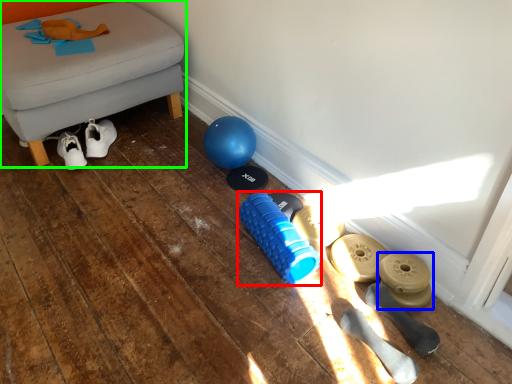
Question: Which object is the closest to the dumbbell (highlighted by a red box)? Choose among these: footwear (highlighted by a blue box) or furniture (highlighted by a green box).

Choices:
 (A) footwear
 (B) furniture

Answer: (A)